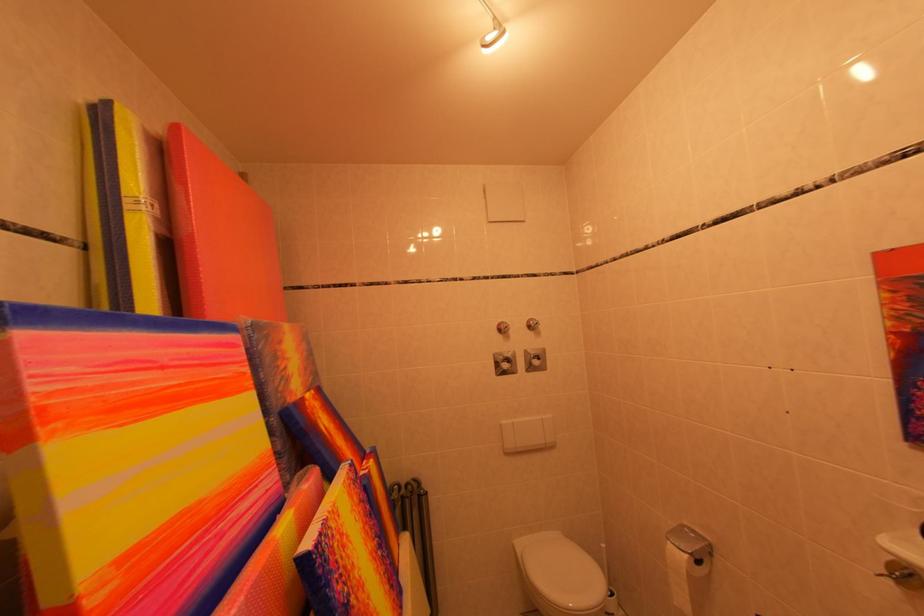
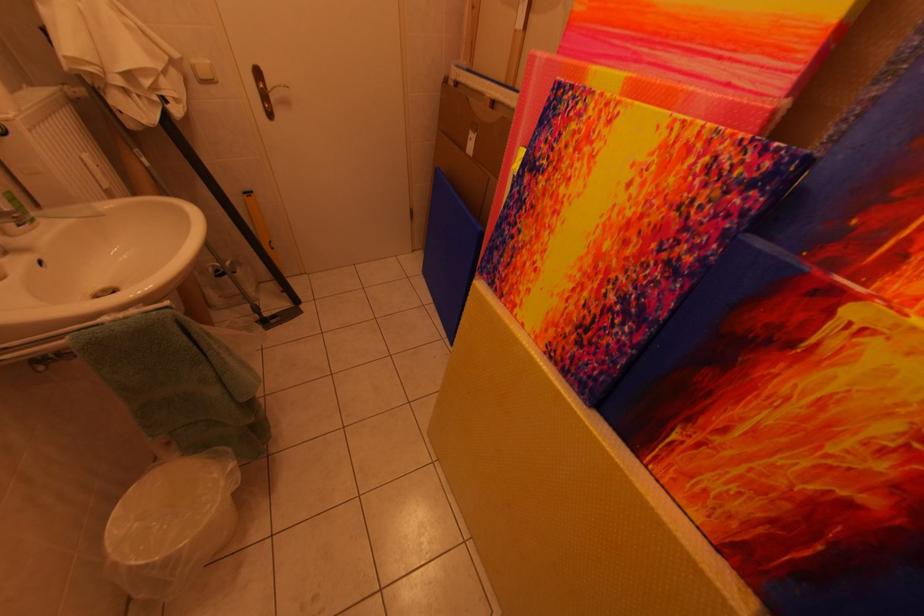
Find the pixel in the second image that matches the point at 380,477 in the first image.

(861, 317)